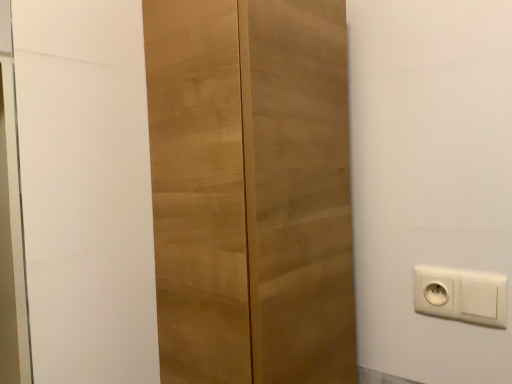
Question: In terms of height, does light wood cupboard at center look taller or shorter compared to white plastic power plugs and sockets at lower right?

Choices:
 (A) tall
 (B) short

Answer: (A)

Question: In the image, is light wood cupboard at center positioned in front of or behind white plastic power plugs and sockets at lower right?

Choices:
 (A) front
 (B) behind

Answer: (A)

Question: Is light wood cupboard at center inside or outside of white plastic power plugs and sockets at lower right?

Choices:
 (A) outside
 (B) inside

Answer: (A)

Question: Is white plastic power plugs and sockets at lower right bigger or smaller than light wood cupboard at center?

Choices:
 (A) big
 (B) small

Answer: (B)

Question: Considering the positions of white plastic power plugs and sockets at lower right and light wood cupboard at center in the image, is white plastic power plugs and sockets at lower right taller or shorter than light wood cupboard at center?

Choices:
 (A) tall
 (B) short

Answer: (B)

Question: Relative to light wood cupboard at center, is white plastic power plugs and sockets at lower right in front or behind?

Choices:
 (A) behind
 (B) front

Answer: (A)

Question: Is white plastic power plugs and sockets at lower right spatially inside light wood cupboard at center, or outside of it?

Choices:
 (A) inside
 (B) outside

Answer: (B)